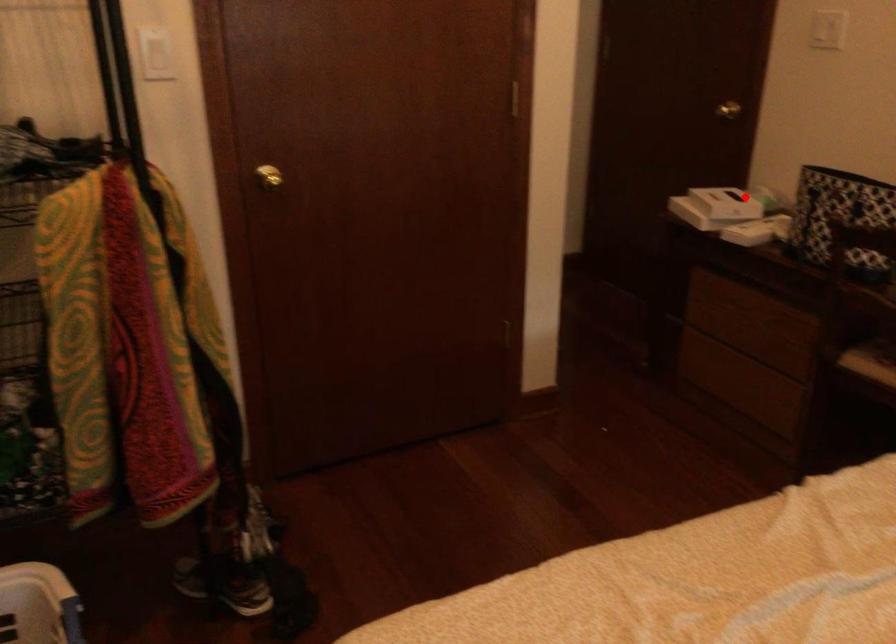
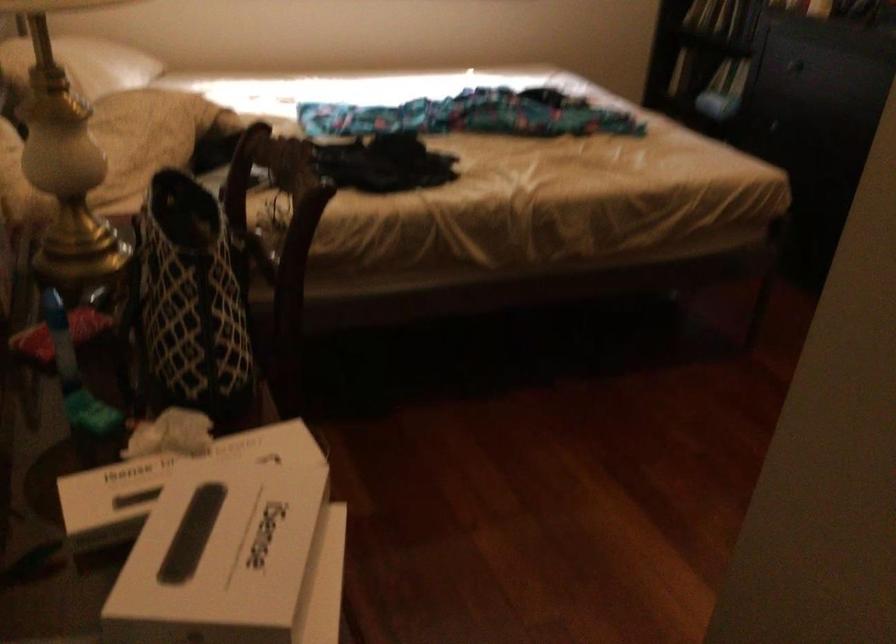
Question: I am providing you with two images of the same scene from different viewpoints. In image1, a red point is highlighted. Considering the same 3D point in image2, which of the following is correct?

Choices:
 (A) It is closer
 (B) It is farther

Answer: (A)